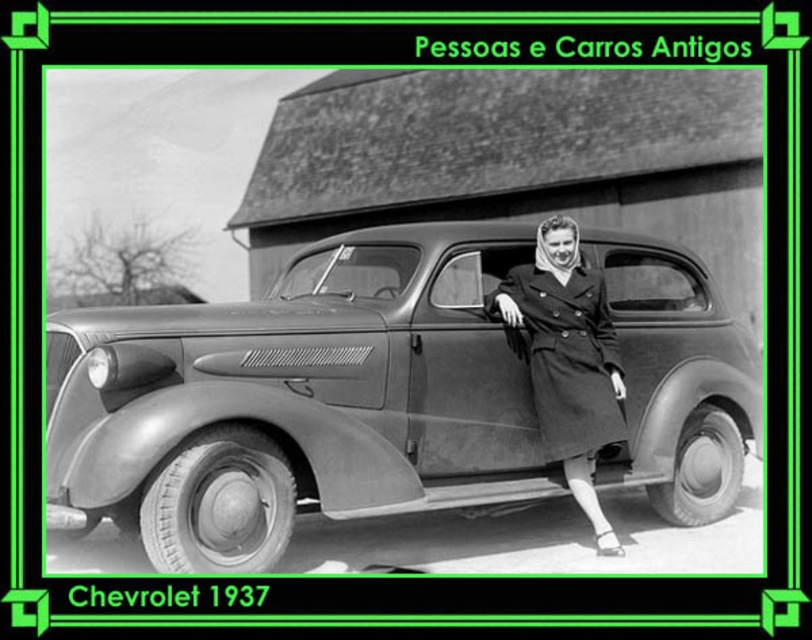
Question: Can you confirm if matte black car at center is positioned below matte black coat at center?

Choices:
 (A) no
 (B) yes

Answer: (B)

Question: Can you confirm if matte black car at center is positioned to the left of matte black coat at center?

Choices:
 (A) yes
 (B) no

Answer: (A)

Question: Which point is farther to the camera?

Choices:
 (A) matte black coat at center
 (B) matte black car at center

Answer: (A)

Question: Which point is closer to the camera taking this photo?

Choices:
 (A) (569, 323)
 (B) (149, 403)

Answer: (B)

Question: Can you confirm if matte black car at center is positioned above matte black coat at center?

Choices:
 (A) yes
 (B) no

Answer: (B)